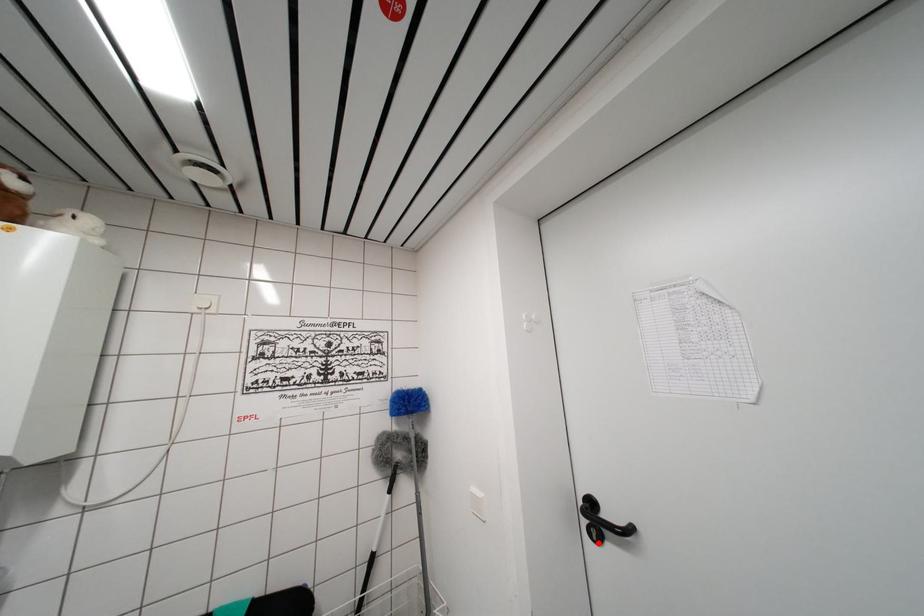
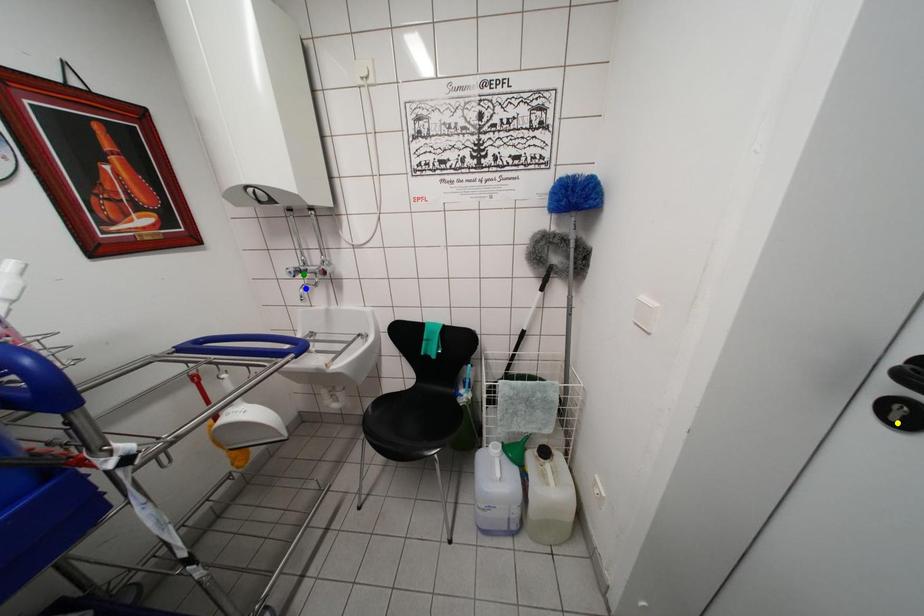
Question: I am providing you with two images of the same scene from different viewpoints. A red point is marked on the first image. You are given multiple points on the second image. In image 2, which mark is for the same physical point as the one in image 1?

Choices:
 (A) yellow point
 (B) green point
 (C) blue point

Answer: (A)